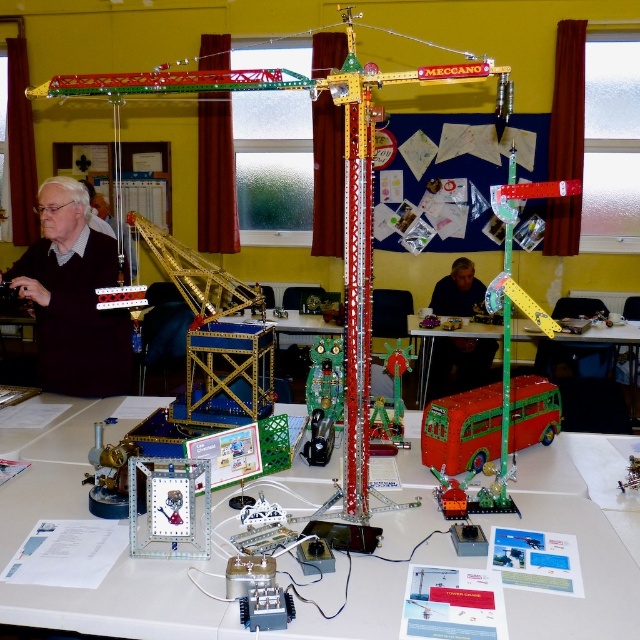
Does dark blue shirt at center appear on the right side of green plastic bus at center?

In fact, dark blue shirt at center is to the left of green plastic bus at center.

Is point (435, 368) in front of point (518, 336)?

No.

Measure the distance between point (433, 376) and camera.

The distance of point (433, 376) from camera is 6.03 meters.

What are the coordinates of `dark blue shirt at center` in the screenshot? It's located at (460, 364).

Between metallic silver clock at center and matte black sweater at left, which one appears on the right side from the viewer's perspective?

metallic silver clock at center

Is metallic silver clock at center to the right of matte black sweater at left from the viewer's perspective?

Correct, you'll find metallic silver clock at center to the right of matte black sweater at left.

Which is behind, point (58, 620) or point (56, 291)?

Point (56, 291)

You are a GUI agent. You are given a task and a screenshot of the screen. Output one action in this format:
    pyautogui.click(x=<x>, y=<y>)
    Task: Click on the metallic silver clock at center
    The width and height of the screenshot is (640, 640).
    Given the screenshot: What is the action you would take?
    pyautogui.click(x=579, y=550)

Is metallic red crane at center smaller than shiny red bus at center?

No, metallic red crane at center is not smaller than shiny red bus at center.

Between point (364, 426) and point (490, 426), which one is positioned in front?

Point (364, 426)

Measure the distance between point (364, 81) and camera.

A distance of 6.37 feet exists between point (364, 81) and camera.

This screenshot has width=640, height=640. In order to click on metallic red crane at center in this screenshot , I will do `click(371, 225)`.